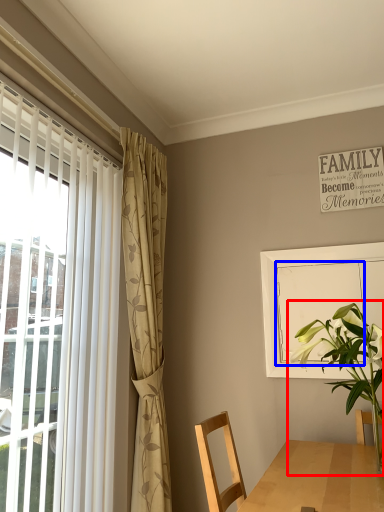
Question: Among these objects, which one is nearest to the camera, houseplant (highlighted by a red box) or screen door (highlighted by a blue box)?

Choices:
 (A) houseplant
 (B) screen door

Answer: (A)